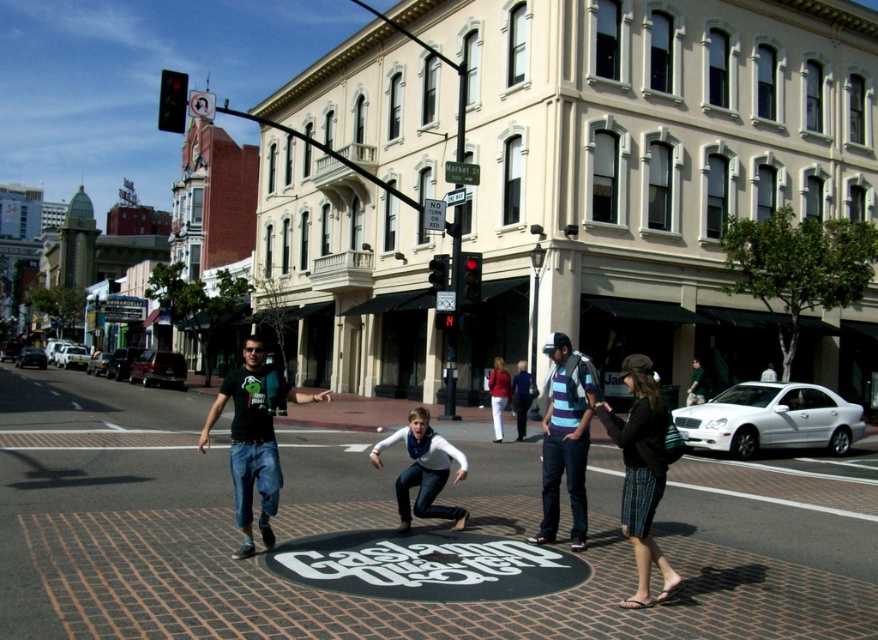
Based on the photo, between black textured pants at lower right and striped cotton shirt at center, which one has less height?

With less height is black textured pants at lower right.

Is black textured pants at lower right above striped cotton shirt at center?

Incorrect, black textured pants at lower right is not positioned above striped cotton shirt at center.

Is point (643, 381) positioned in front of point (572, 520)?

Yes.

This screenshot has width=878, height=640. I want to click on black textured pants at lower right, so click(x=642, y=472).

Which is in front, point (264, 419) or point (551, 422)?

Point (264, 419)

Who is taller, dark green t-shirt at center or striped cotton shirt at center?

A: dark green t-shirt at center is taller.

Which is in front, point (299, 397) or point (567, 346)?

Positioned in front is point (299, 397).

This screenshot has width=878, height=640. Identify the location of dark green t-shirt at center. 253,438.

Is black textured pants at lower right shorter than dark green t-shirt at center?

Yes, black textured pants at lower right is shorter than dark green t-shirt at center.

Which is behind, point (616, 422) or point (236, 490)?

The point (236, 490) is more distant.

Measure the distance between black textured pants at lower right and camera.

black textured pants at lower right is 5.64 meters away from camera.

The image size is (878, 640). Find the location of `black textured pants at lower right`. black textured pants at lower right is located at coordinates (642, 472).